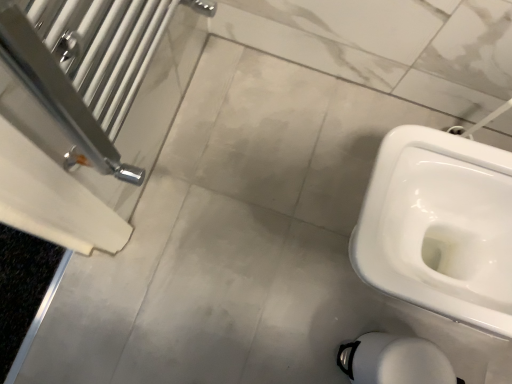
Describe the element at coordinates (394, 360) in the screenshot. I see `white glossy toilet at lower right` at that location.

Find the location of a particular element. Image resolution: width=512 pixels, height=384 pixels. white glossy toilet at lower right is located at coordinates (394, 360).

I want to click on white glossy toilet at lower right, so click(x=394, y=360).